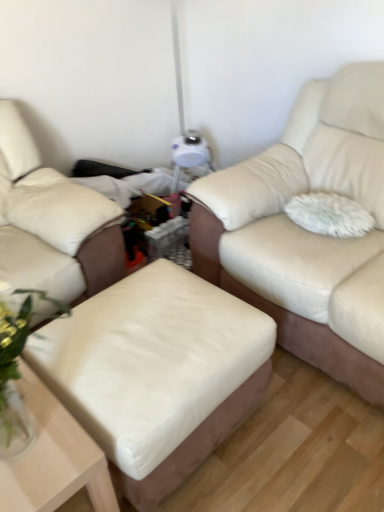
Identify the location of vacant point above white matte table at lower left (from a real-world perspective). This screenshot has height=512, width=384. [x=36, y=426].